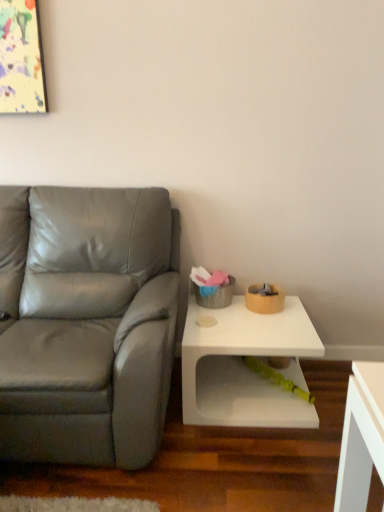
At what (x,y) coordinates should I click in order to perform the action: click on vacant space situated above white matte table at lower right (from a real-world perspective). Please return your answer as a coordinate pair (x, y). The width and height of the screenshot is (384, 512). Looking at the image, I should click on (249, 322).